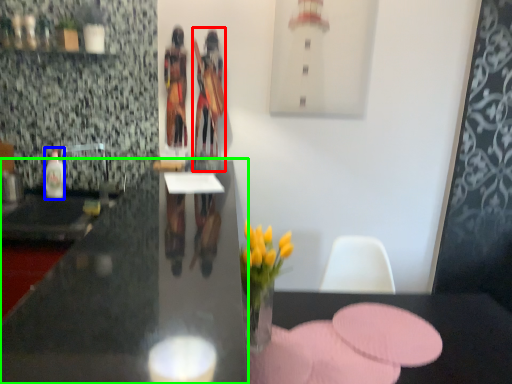
Question: Which is farther away from person (highlighted by a red box)? bottle (highlighted by a blue box) or desk (highlighted by a green box)?

Choices:
 (A) bottle
 (B) desk

Answer: (B)